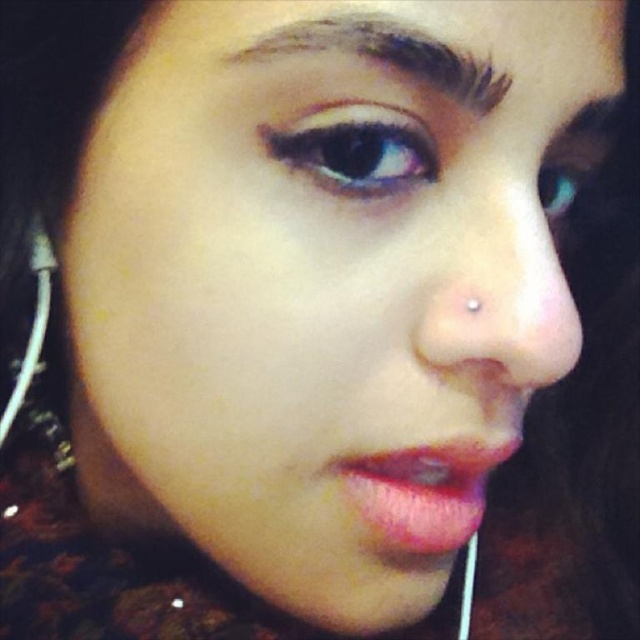
You are holding a 10 inch ruler and want to measure the distance from your eyes to the point at coordinates point [282,150] in the image. Can you reach it with your ruler?

The point at coordinates point [282,150] is 12.18 inches away from the viewer, so the 10 inch ruler is not long enough to reach it.

You are an artist trying to sketch this portrait. You need to place the dark brown hair at upper center precisely. What are the coordinates where you should position it?

The dark brown hair at upper center should be positioned at coordinates point (x=390, y=52).